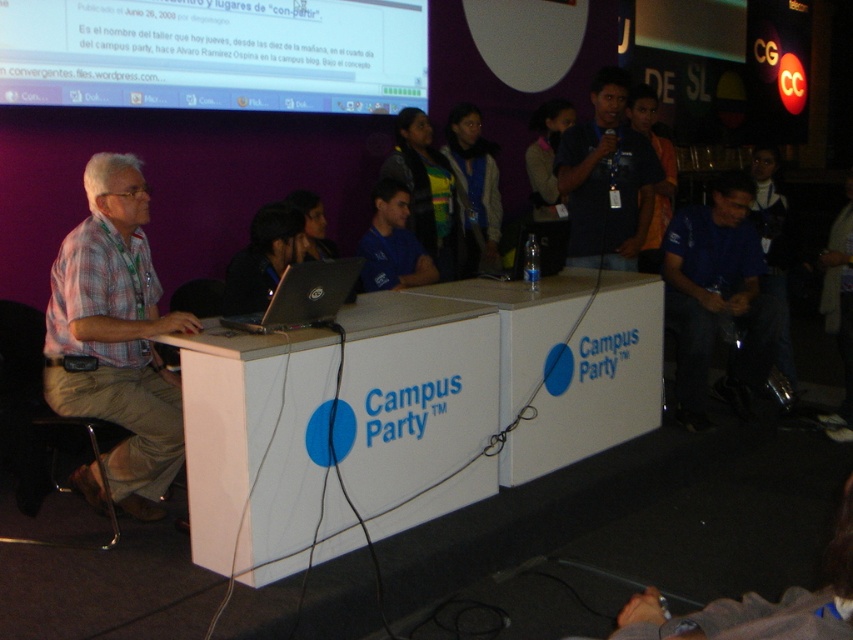
You are standing at the entrance of the Campus Party event hall and want to take a photo that includes both the point at coordinates (444, 454) and the point at coordinates (397, 266). Based on their positions, which point is closer to your camera when taking the photo?

Point (444, 454) is closer to the camera than point (397, 266), so it will appear nearer in the photo.

You are attending the Campus Party event and notice a white glossy table at center and a blue fabric shirt at center. From your perspective, which object is closer to you?

The blue fabric shirt at center is closer to you because the white glossy table at center is positioned under it, indicating that the shirt is above and thus nearer.